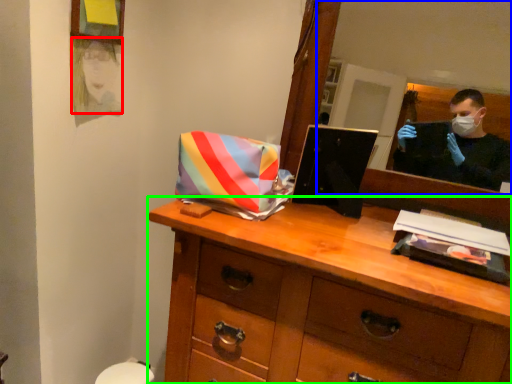
Question: Which object is positioned closest to person (highlighted by a red box)? Select from mirror (highlighted by a blue box) and chest of drawers (highlighted by a green box).

Choices:
 (A) mirror
 (B) chest of drawers

Answer: (B)